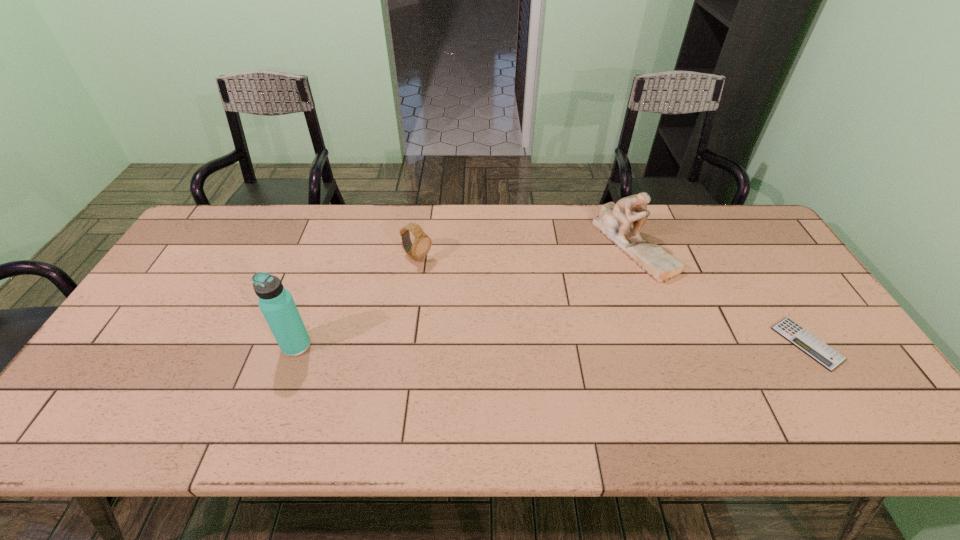
Identify the location of free location located 0.380m on the face of the watch. This screenshot has height=540, width=960. (530, 328).

Identify the location of blank space located 0.260m on the face of the watch. Image resolution: width=960 pixels, height=540 pixels. (495, 306).

At what (x,y) coordinates should I click in order to perform the action: click on free spot located 0.360m on the face of the watch. Please return your answer as a coordinate pair (x, y). This screenshot has width=960, height=540. Looking at the image, I should click on (524, 325).

Where is `free space located 0.390m on the front-facing side of the figurine`? free space located 0.390m on the front-facing side of the figurine is located at coordinates (627, 396).

You are a GUI agent. You are given a task and a screenshot of the screen. Output one action in this format:
    pyautogui.click(x=<x>, y=<y>)
    Task: Click on the vacant region located on the front-facing side of the figurine
    
    Given the screenshot: What is the action you would take?
    (632, 322)

This screenshot has width=960, height=540. Identify the location of vacant space located on the front-facing side of the figurine. (633, 316).

Find the location of a particular element. watch located in the far edge section of the desktop is located at coordinates (420, 248).

Where is `figurine present at the far edge`? figurine present at the far edge is located at coordinates [614, 220].

Image resolution: width=960 pixels, height=540 pixels. Find the location of `object located in the near edge section of the desktop`. object located in the near edge section of the desktop is located at coordinates (822, 353).

Locate an element on the screen. The height and width of the screenshot is (540, 960). object that is at the right edge is located at coordinates (822, 353).